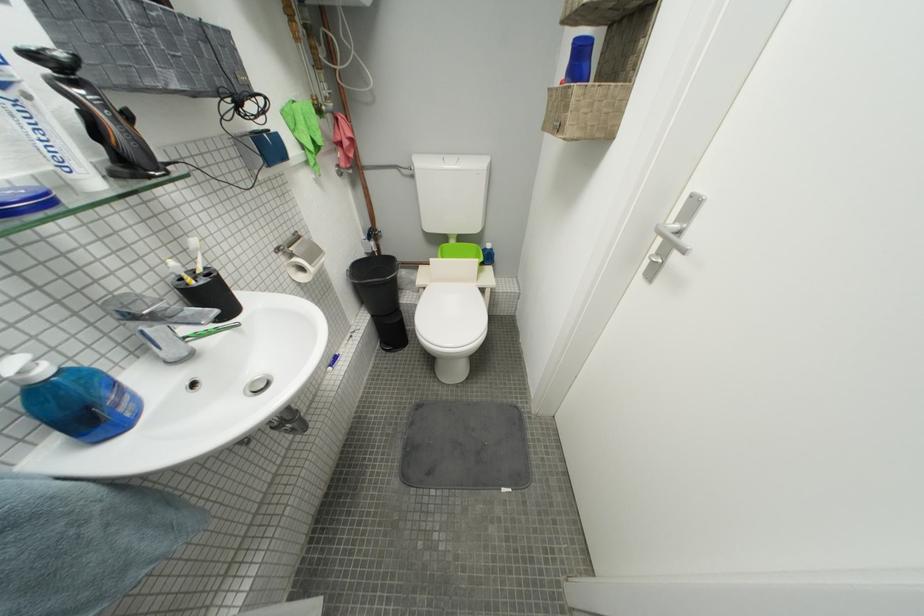
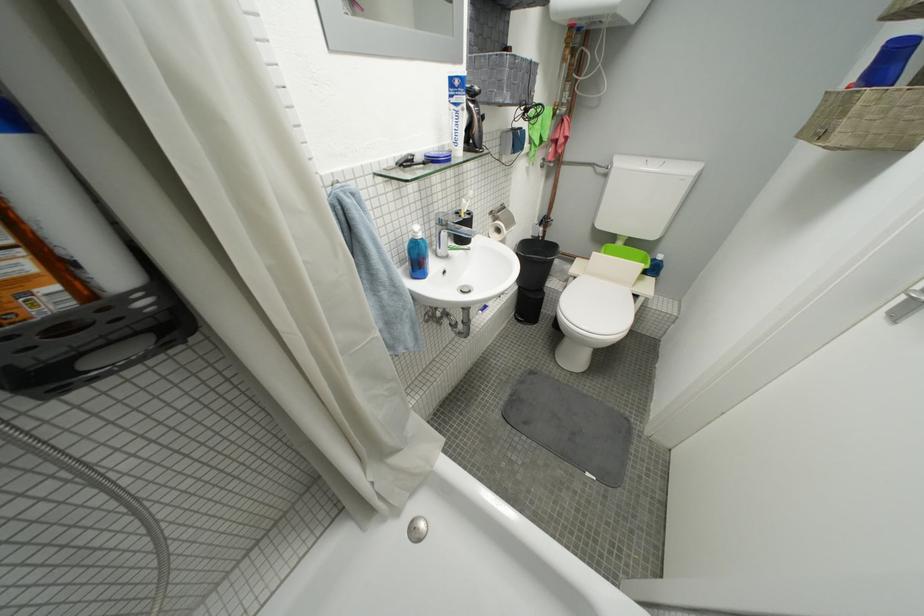
In the second image, find the point that corresponds to point 286,251 in the first image.

(500, 214)